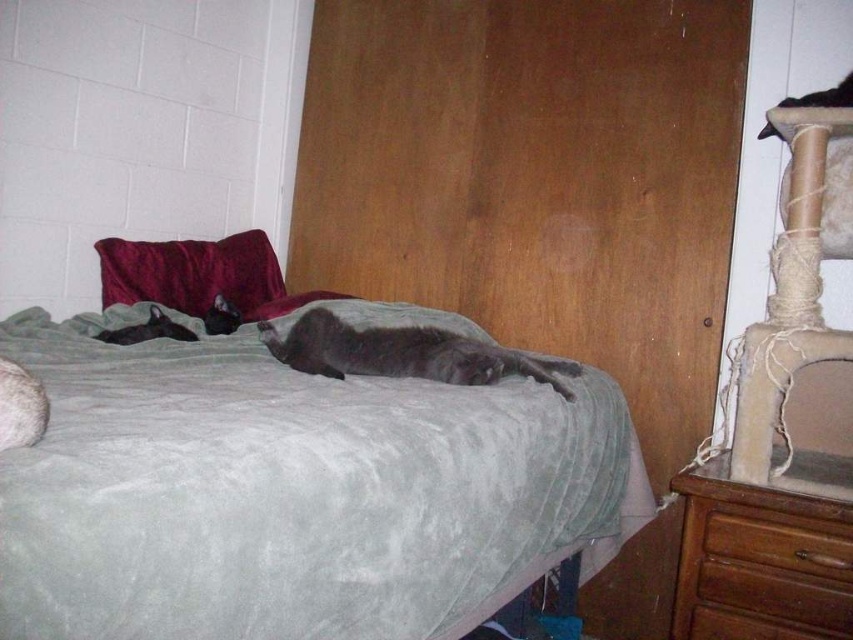
Is gray velvety blanket at center shorter than gray soft fur cat at center?

No.

Between point (547, 428) and point (357, 332), which one is positioned behind?

Point (357, 332)

At what (x,y) coordinates should I click in order to perform the action: click on gray velvety blanket at center. Please return your answer as a coordinate pair (x, y). Looking at the image, I should click on (291, 492).

Between point (321, 368) and point (842, 97), which one is positioned in front?

Point (842, 97) is more forward.

Can you confirm if gray soft fur cat at center is wider than black fur cat at upper right?

Yes.

In order to click on gray soft fur cat at center in this screenshot , I will do `click(403, 353)`.

Which is below, gray velvety blanket at center or dark gray fur cat at left?

gray velvety blanket at center is lower down.

Between gray velvety blanket at center and dark gray fur cat at left, which one has less height?

With less height is dark gray fur cat at left.

Is point (396, 595) less distant than point (99, 332)?

Yes, point (396, 595) is closer to viewer.

The height and width of the screenshot is (640, 853). Find the location of `gray velvety blanket at center`. gray velvety blanket at center is located at coordinates (291, 492).